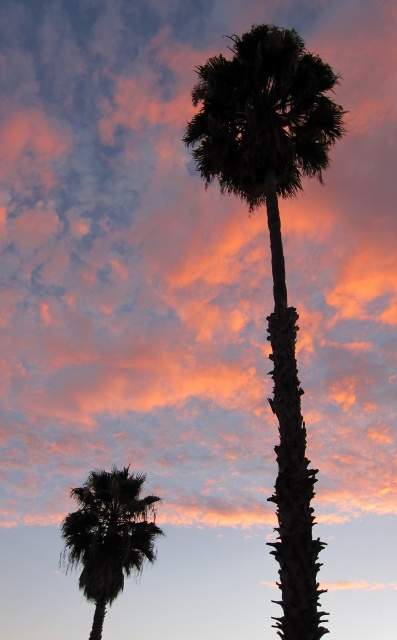
You are standing in the sunset scene and want to place a small decorative rock at a point that is closer to you than the other point. Which point should you choose between point (285, 625) and point (69, 515)?

Point (285, 625) is in front of point (69, 515), so you should choose point (285, 625) as it is closer to you.

You are planning to install a pathway between the silhouette palm tree at center and the silhouette palm at lower left. The pathway requires a minimum of 30 feet of space. Based on the scene, will the available space between them suffice for the pathway?

The distance between the silhouette palm tree at center and the silhouette palm at lower left is 34.63 feet, which exceeds the required 30 feet. Therefore, the available space is sufficient for the pathway.

You are standing in front of the sunset scene and want to take a photo of the silhouette palm tree at center and the silhouette palm at lower left. Which palm tree will appear closer to the camera in your photo?

The silhouette palm tree at center will appear closer to the camera in your photo because it is positioned in front of the silhouette palm at lower left.